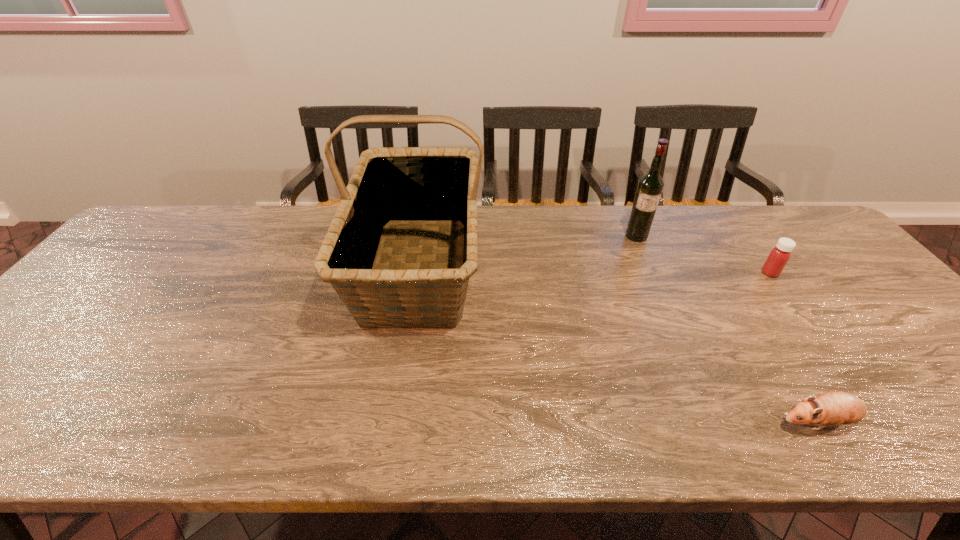
Locate an element on the screen. This screenshot has height=540, width=960. vacant space located on the left of the third tallest object is located at coordinates (665, 273).

This screenshot has width=960, height=540. What are the coordinates of `free spot located at the face of the second object from right to left` in the screenshot? It's located at (667, 422).

The image size is (960, 540). Find the location of `free space located 0.250m at the face of the second object from right to left`. free space located 0.250m at the face of the second object from right to left is located at coordinates (653, 422).

Locate an element on the screen. This screenshot has width=960, height=540. vacant space located 0.310m at the face of the second object from right to left is located at coordinates (623, 422).

Where is `basket present at the far edge`? The height and width of the screenshot is (540, 960). basket present at the far edge is located at coordinates (430, 186).

Where is `wine bottle located in the far edge section of the desktop`? wine bottle located in the far edge section of the desktop is located at coordinates (650, 186).

Where is `object that is at the near edge`? object that is at the near edge is located at coordinates (833, 408).

Locate an element on the screen. vacant region at the far edge is located at coordinates (534, 227).

In the image, there is a desktop. Identify the location of vacant region at the near edge. This screenshot has height=540, width=960. (692, 422).

Identify the location of vacant point at the left edge. (88, 329).